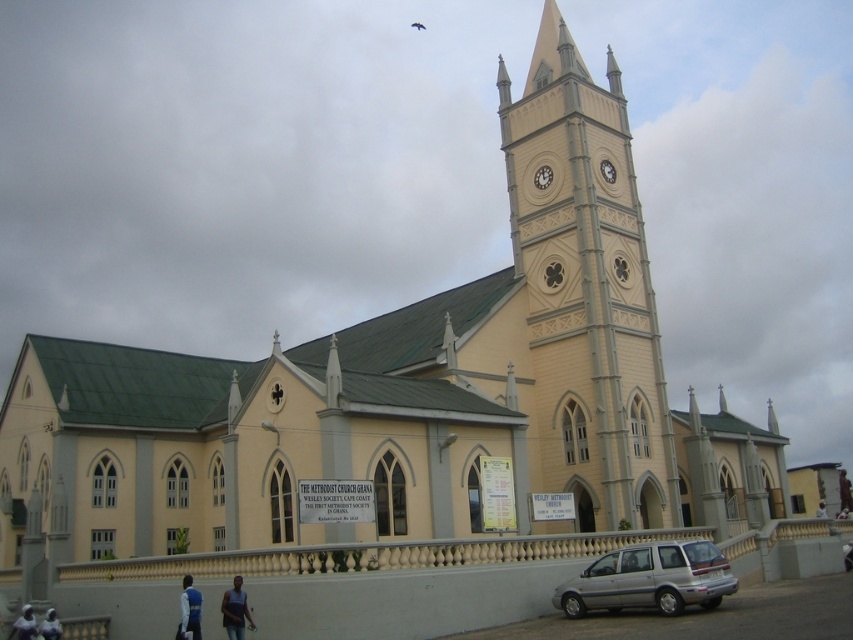
Question: Is yellow wood clock tower at center to the right of dark blue fabric person at lower left from the viewer's perspective?

Choices:
 (A) yes
 (B) no

Answer: (A)

Question: Which object is farther from the camera taking this photo?

Choices:
 (A) blue fabric jacket at lower left
 (B) dark skin human at upper center
 (C) silver metallic van at lower center
 (D) dark skin human at lower left

Answer: (B)

Question: Which object is closer to the camera taking this photo?

Choices:
 (A) silver metallic van at lower center
 (B) dark blue fabric person at lower left

Answer: (A)

Question: Can you confirm if blue fabric jacket at lower left is wider than dark blue fabric person at lower left?

Choices:
 (A) yes
 (B) no

Answer: (A)

Question: Where is dark skin textured shirt at lower center located in relation to dark skin human at lower left in the image?

Choices:
 (A) above
 (B) below

Answer: (A)

Question: Among these objects, which one is nearest to the camera?

Choices:
 (A) yellow wood clock tower at center
 (B) dark blue fabric person at lower left

Answer: (B)